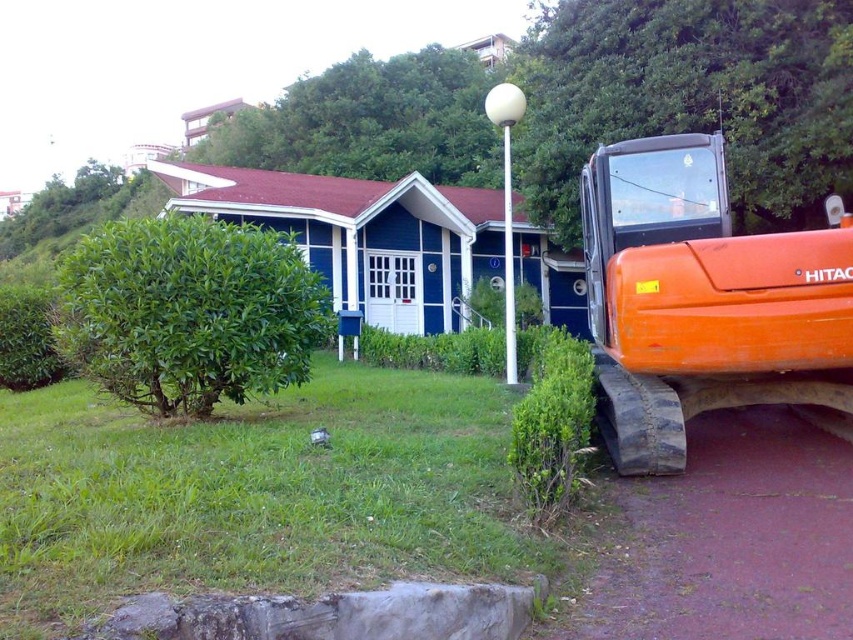
You are a gardener who needs to mow the lawn. You see the green grass at lower left and the orange rubber tractor at right. Which area should you prioritize mowing first if you want to cover the larger grassy area first?

The green grass at lower left should be prioritized first because its width is larger than the orange rubber tractor at right.